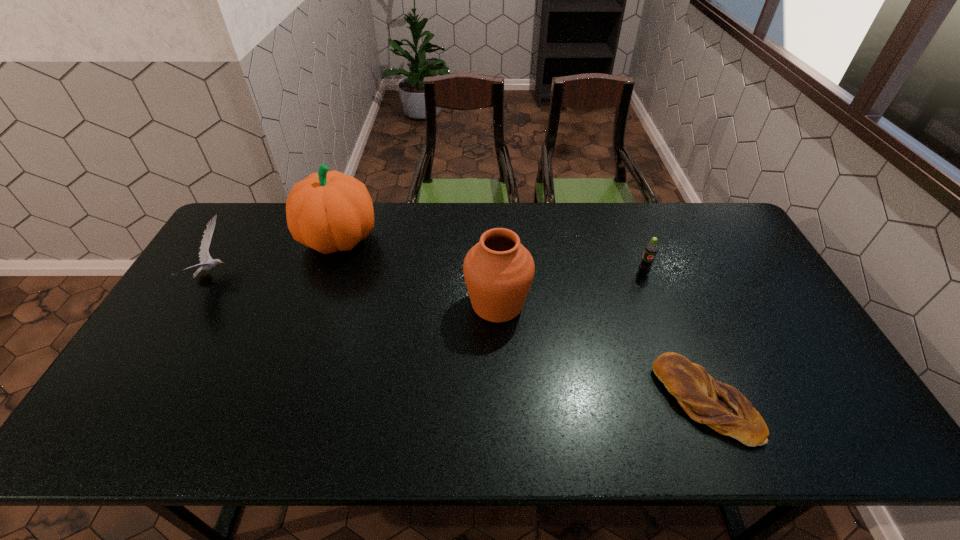
In order to click on vacant space located on the front label of the soda in this screenshot , I will do point(685,388).

Where is `vacant space situated on the back of the nearest object`? Image resolution: width=960 pixels, height=540 pixels. vacant space situated on the back of the nearest object is located at coordinates (675, 323).

Identify the location of object at the far edge. [x=329, y=211].

At what (x,y) coordinates should I click in order to perform the action: click on object that is at the near edge. Please return your answer as a coordinate pair (x, y). Looking at the image, I should click on (722, 407).

Locate an element on the screen. Image resolution: width=960 pixels, height=540 pixels. object that is at the left edge is located at coordinates (204, 255).

Identify the location of free location at the far edge of the desktop. Image resolution: width=960 pixels, height=540 pixels. (415, 214).

In the image, there is a desktop. Where is `free space at the near edge`? This screenshot has height=540, width=960. free space at the near edge is located at coordinates (186, 450).

Identify the location of free space at the left edge of the desktop. This screenshot has height=540, width=960. (195, 336).

In the image, there is a desktop. Find the location of `free space at the right edge`. free space at the right edge is located at coordinates (726, 262).

Where is `vacant space at the far left corner`? vacant space at the far left corner is located at coordinates (275, 218).